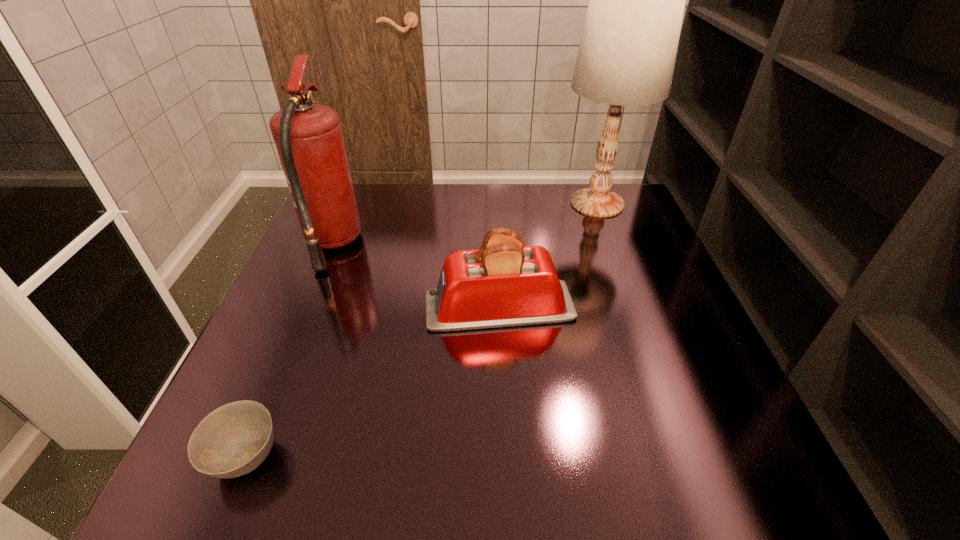
This screenshot has height=540, width=960. In order to click on free space between the shortest object and the tallest object in this screenshot , I will do `click(421, 330)`.

Where is `vacant area that lies between the shortest object and the tallest object`? Image resolution: width=960 pixels, height=540 pixels. vacant area that lies between the shortest object and the tallest object is located at coordinates (421, 330).

The image size is (960, 540). Find the location of `vacant area between the fire extinguisher and the shortest object`. vacant area between the fire extinguisher and the shortest object is located at coordinates (289, 350).

The image size is (960, 540). I want to click on object that ranks as the closest to the third object from left to right, so click(308, 137).

Where is `object that can be found as the third closest to the toaster`? object that can be found as the third closest to the toaster is located at coordinates (233, 440).

This screenshot has height=540, width=960. In order to click on blank area in the image that satisfies the following two spatial constraints: 1. at the front of the third shortest object where the nozzle is aimed; 2. on the left side of the bowl in this screenshot , I will do click(242, 457).

Find the location of a particular element. The height and width of the screenshot is (540, 960). free location that satisfies the following two spatial constraints: 1. at the front of the fire extinguisher where the nozzle is aimed; 2. on the back side of the toaster is located at coordinates (305, 307).

Image resolution: width=960 pixels, height=540 pixels. I want to click on vacant region that satisfies the following two spatial constraints: 1. at the front of the fire extinguisher where the nozzle is aimed; 2. on the right side of the third object from left to right, so click(305, 307).

Where is `blank area in the image that satisfies the following two spatial constraints: 1. at the front of the bowl where the nozzle is aimed; 2. on the right side of the third shortest object`? This screenshot has height=540, width=960. blank area in the image that satisfies the following two spatial constraints: 1. at the front of the bowl where the nozzle is aimed; 2. on the right side of the third shortest object is located at coordinates (242, 457).

Find the location of `vacant area that satisfies the following two spatial constraints: 1. on the back side of the lamp; 2. on the right side of the second object from right to left`. vacant area that satisfies the following two spatial constraints: 1. on the back side of the lamp; 2. on the right side of the second object from right to left is located at coordinates (494, 203).